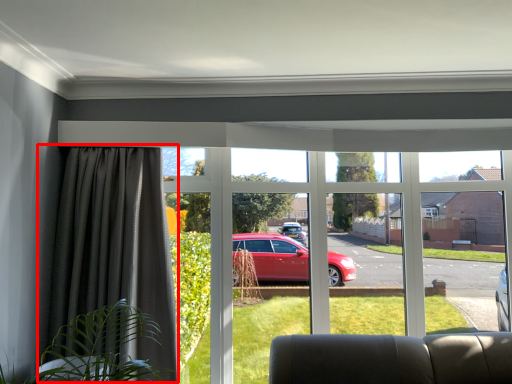
Question: Considering the relative positions of curtain (annotated by the red box) and window in the image provided, where is curtain (annotated by the red box) located with respect to the staircase?

Choices:
 (A) right
 (B) left

Answer: (B)